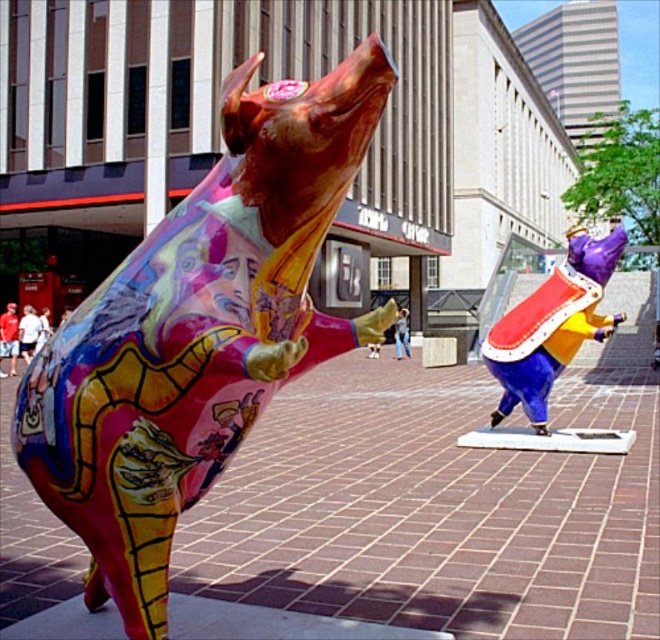
You are an artist planning to take a photo of the multicolored painted bull at center and the shiny purple and gold helmet at center. Which object should you focus on if you want to capture the taller one in your shot?

The multicolored painted bull at center is much taller than the shiny purple and gold helmet at center, so you should focus on the multicolored painted bull at center to capture the taller one in your shot.

You are an artist planning to photograph the multicolored painted bull at center and the shiny purple and gold helmet at center. You want to ensure both subjects are fully visible in your composition. Given that your camera frame can only accommodate objects up to the width of the wider of the two, which object should you prioritize positioning first?

The shiny purple and gold helmet at center is wider than the multicolored painted bull at center. Therefore, you should prioritize positioning the shiny purple and gold helmet at center first to ensure it fits within the camera frame.